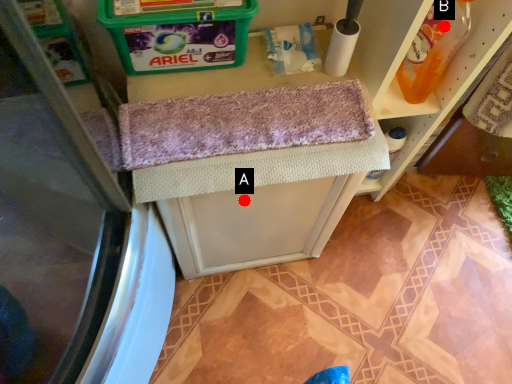
Question: Two points are circled on the image, labeled by A and B beside each circle. Which point is closer to the camera?

Choices:
 (A) A is closer
 (B) B is closer

Answer: (B)